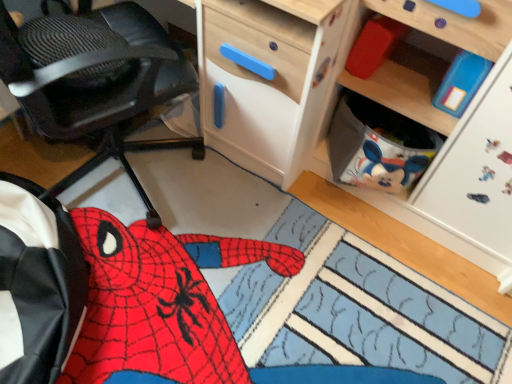
Locate an element on the screen. wooden cabinet at upper right is located at coordinates (273, 80).

What do you see at coordinates (273, 80) in the screenshot? The width and height of the screenshot is (512, 384). I see `wooden cabinet at upper right` at bounding box center [273, 80].

The width and height of the screenshot is (512, 384). In order to click on wooden cabinet at upper right in this screenshot , I will do `click(273, 80)`.

From the image's perspective, which is above, matte red block at upper right or black textured office chair at left?

matte red block at upper right appears higher in the image.

How many degrees apart are the facing directions of matte red block at upper right and black textured office chair at left?

145 degrees.

Could you tell me if matte red block at upper right is turned towards black textured office chair at left?

No, matte red block at upper right is not facing towards black textured office chair at left.

Which point is more forward, (66, 89) or (304, 125)?

Point (66, 89)

Does black textured office chair at left turn towards wooden cabinet at upper right?

Yes, black textured office chair at left is aimed at wooden cabinet at upper right.

Choose the correct answer: Is black textured office chair at left inside wooden cabinet at upper right or outside it?

black textured office chair at left cannot be found inside wooden cabinet at upper right.

This screenshot has height=384, width=512. I want to click on chair lying on the left of wooden cabinet at upper right, so click(100, 87).

Could you tell me if wooden cabinet at upper right is turned towards black textured office chair at left?

No, wooden cabinet at upper right is not facing towards black textured office chair at left.

Between wooden cabinet at upper right and black textured office chair at left, which one appears on the left side from the viewer's perspective?

black textured office chair at left is more to the left.

Does wooden cabinet at upper right have a greater height compared to black textured office chair at left?

No.

Looking at the image, does wooden cabinet at upper right seem bigger or smaller compared to black textured office chair at left?

Considering their sizes, wooden cabinet at upper right takes up less space than black textured office chair at left.

Identify the location of cabinetry lying in front of the matte red block at upper right. The width and height of the screenshot is (512, 384). (273, 80).

What's the angular difference between wooden cabinet at upper right and matte red block at upper right's facing directions?

wooden cabinet at upper right and matte red block at upper right are facing 4.48 degrees away from each other.

From the image's perspective, which is above, wooden cabinet at upper right or matte red block at upper right?

matte red block at upper right.

Would you say wooden cabinet at upper right contains matte red block at upper right?

Yes, matte red block at upper right is surrounded by wooden cabinet at upper right.

Is wooden cabinet at upper right at the back of matte red block at upper right?

Yes.

Which is closer, [362,40] or [300,77]?

Point [362,40] appears to be farther away from the viewer than point [300,77].

From the image's perspective, who appears lower, matte red block at upper right or wooden cabinet at upper right?

From the image's view, wooden cabinet at upper right is below.

Considering the sizes of objects black textured office chair at left and matte red block at upper right in the image provided, who is thinner, black textured office chair at left or matte red block at upper right?

Thinner between the two is matte red block at upper right.

Are black textured office chair at left and matte red block at upper right beside each other?

No, black textured office chair at left is not making contact with matte red block at upper right.

Is matte red block at upper right surrounded by black textured office chair at left?

No, matte red block at upper right is located outside of black textured office chair at left.

From a real-world perspective, which is physically below, black textured office chair at left or matte red block at upper right?

From a 3D spatial view, black textured office chair at left is below.

The height and width of the screenshot is (384, 512). I want to click on toy on the right of black textured office chair at left, so click(x=374, y=45).

Where is `chair positioned vertically above the wooden cabinet at upper right (from a real-world perspective)`? chair positioned vertically above the wooden cabinet at upper right (from a real-world perspective) is located at coordinates (100, 87).

Which object lies nearer to the anchor point wooden cabinet at upper right, black textured office chair at left or matte red block at upper right?

matte red block at upper right is closer to wooden cabinet at upper right.

Considering their positions, is wooden cabinet at upper right positioned closer to matte red block at upper right than black textured office chair at left?

Among the two, wooden cabinet at upper right is located nearer to matte red block at upper right.

In the scene shown: When comparing their distances from black textured office chair at left, does matte red block at upper right or wooden cabinet at upper right seem closer?

wooden cabinet at upper right.

When comparing their distances from matte red block at upper right, does black textured office chair at left or wooden cabinet at upper right seem closer?

wooden cabinet at upper right.

Considering their positions, is wooden cabinet at upper right positioned closer to black textured office chair at left than matte red block at upper right?

wooden cabinet at upper right lies closer to black textured office chair at left than the other object.

Consider the image. Estimate the real-world distances between objects in this image. Which object is further from wooden cabinet at upper right, matte red block at upper right or black textured office chair at left?

black textured office chair at left.

Identify the location of toy between black textured office chair at left and wooden cabinet at upper right from left to right. Image resolution: width=512 pixels, height=384 pixels. (374, 45).